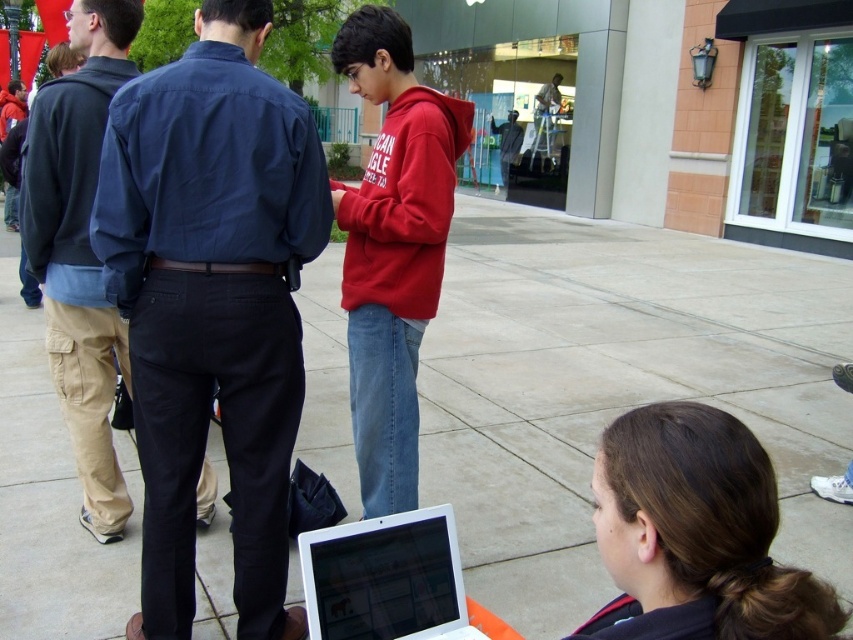
You are standing at the point labeled point (369,220) and want to walk towards the point labeled point (376,572). Will you be moving away from or towards the camera as you walk?

Since point (369,220) is further to the camera than point (376,572), walking from point (369,220) to point (376,572) would mean moving away from the camera.

You are a photographer positioned at the back of the scene. You want to take a photo that includes both the red fleece hoodie at center and the khaki cargo pants at left. Which object should you adjust your focus to first to ensure both are in the frame?

The red fleece hoodie at center is closer to the viewer than the khaki cargo pants at left, so you should focus on the red fleece hoodie at center first to ensure both are in the frame.